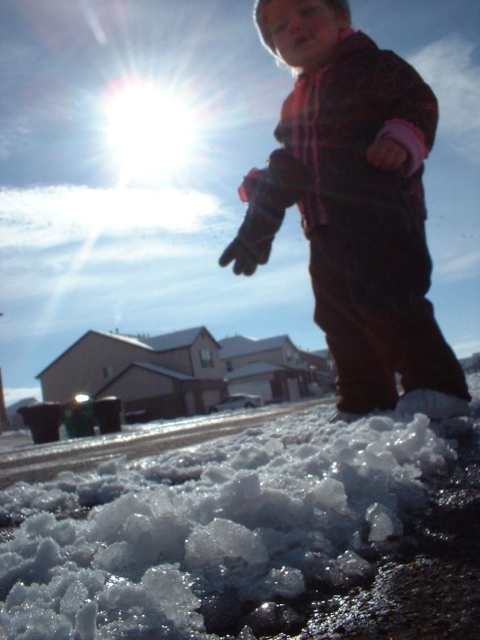
You are standing at the edge of the icy area and want to reach the point marked as point (x=277, y=442). If your walking speed is 3 feet per second, how many seconds will it take you to reach that point?

The point (x=277, y=442) is 8.32 feet away from the viewer. At a speed of 3 feet per second, it would take approximately 2.77 seconds to reach it.

You are a parent looking for your child in the winter scene. You see the white crystalline snow at lower center and the plaid fleece jacket at upper right. Which object is closer to the ground?

The white crystalline snow at lower center is closer to the ground because it is positioned below the plaid fleece jacket at upper right.

You are a photographer trying to capture the icy scene while standing near the child. You want to ensure the white crystalline snow at lower center and the plaid fleece jacket at upper right are both visible in your shot. Based on their positions, which object will appear closer to the camera?

The white crystalline snow at lower center is in front of the plaid fleece jacket at upper right, so it will appear closer to the camera.